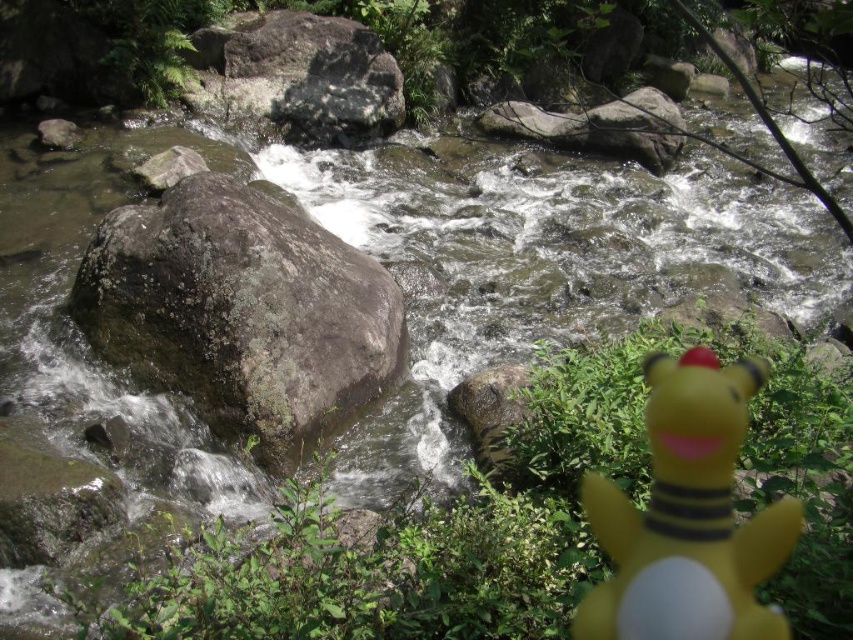
Which is below, green mossy rock at center-left or yellow rubber duck at lower right?

yellow rubber duck at lower right is lower down.

Is green mossy rock at center-left below yellow rubber duck at lower right?

No, green mossy rock at center-left is not below yellow rubber duck at lower right.

I want to click on green mossy rock at center-left, so point(241,314).

Is point (126, 241) positioned after point (201, 60)?

No, it is not.

Locate an element on the screen. This screenshot has width=853, height=640. green mossy rock at center-left is located at coordinates (241, 314).

Consider the image. Does yellow rubber duck at lower right have a lesser height compared to gray rough rock at upper center?

Yes.

Is yellow rubber duck at lower right taller than gray rough rock at upper center?

Incorrect, yellow rubber duck at lower right's height is not larger of gray rough rock at upper center's.

Is point (715, 388) closer to viewer compared to point (341, 81)?

Yes, point (715, 388) is in front of point (341, 81).

Identify the location of yellow rubber duck at lower right. (688, 516).